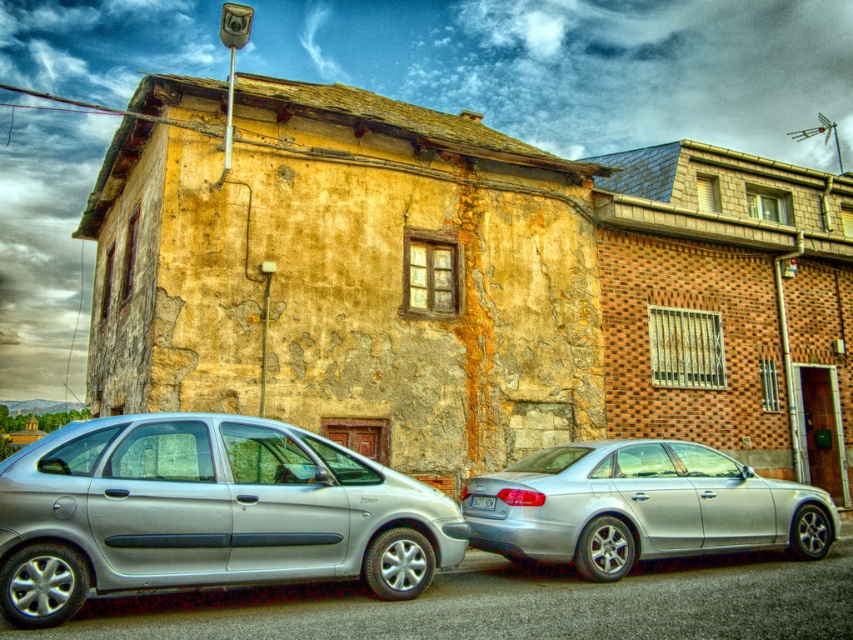
Question: Does silver metallic sedan at center come in front of white plastic license plate at center?

Choices:
 (A) yes
 (B) no

Answer: (A)

Question: Which object appears closest to the camera in this image?

Choices:
 (A) white plastic license plate at center
 (B) silver metallic sedan at center

Answer: (B)

Question: Which of the following is the farthest from the observer?

Choices:
 (A) white plastic license plate at center
 (B) silver metallic sedan at center

Answer: (A)

Question: Is silver metallic sedan at center bigger than white plastic license plate at center?

Choices:
 (A) yes
 (B) no

Answer: (A)

Question: Which of these objects is positioned closest to the silver metallic hatchback at lower left?

Choices:
 (A) white plastic license plate at center
 (B) silver metallic sedan at center

Answer: (B)

Question: Can you confirm if silver metallic hatchback at lower left is positioned to the left of silver metallic sedan at center?

Choices:
 (A) no
 (B) yes

Answer: (B)